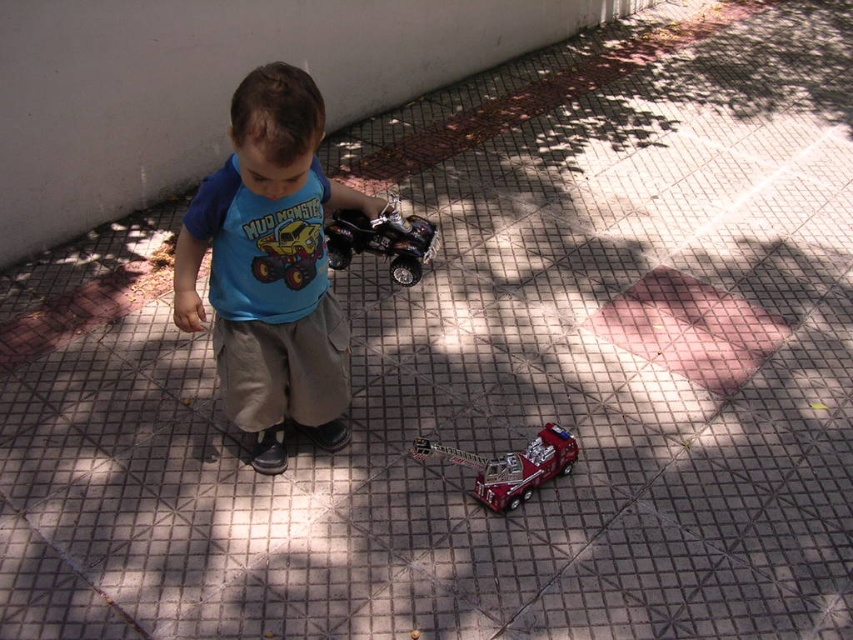
Which is above, shiny red firetruck at center or shiny metallic quad bike at center?

shiny metallic quad bike at center is higher up.

Measure the distance between shiny red firetruck at center and shiny metallic quad bike at center.

shiny red firetruck at center and shiny metallic quad bike at center are 27.09 inches apart from each other.

Between point (457, 451) and point (392, 221), which one is positioned behind?

Point (457, 451)

Identify the location of shiny red firetruck at center. (509, 465).

Who is higher up, shiny red firetruck at center or shiny yellow plastic truck at center?

shiny yellow plastic truck at center is higher up.

Is shiny red firetruck at center above shiny yellow plastic truck at center?

Incorrect, shiny red firetruck at center is not positioned above shiny yellow plastic truck at center.

The height and width of the screenshot is (640, 853). What do you see at coordinates (509, 465) in the screenshot?
I see `shiny red firetruck at center` at bounding box center [509, 465].

The height and width of the screenshot is (640, 853). I want to click on shiny red firetruck at center, so click(x=509, y=465).

Is blue cotton shirt at center positioned before shiny red firetruck at center?

Yes, it is in front of shiny red firetruck at center.

Between blue cotton shirt at center and shiny red firetruck at center, which one has more height?

blue cotton shirt at center

Is point (306, 403) closer to viewer compared to point (564, 461)?

Yes.

You are a GUI agent. You are given a task and a screenshot of the screen. Output one action in this format:
    pyautogui.click(x=<x>, y=<y>)
    Task: Click on the blue cotton shirt at center
    This screenshot has width=853, height=640.
    Given the screenshot: What is the action you would take?
    pyautogui.click(x=271, y=268)